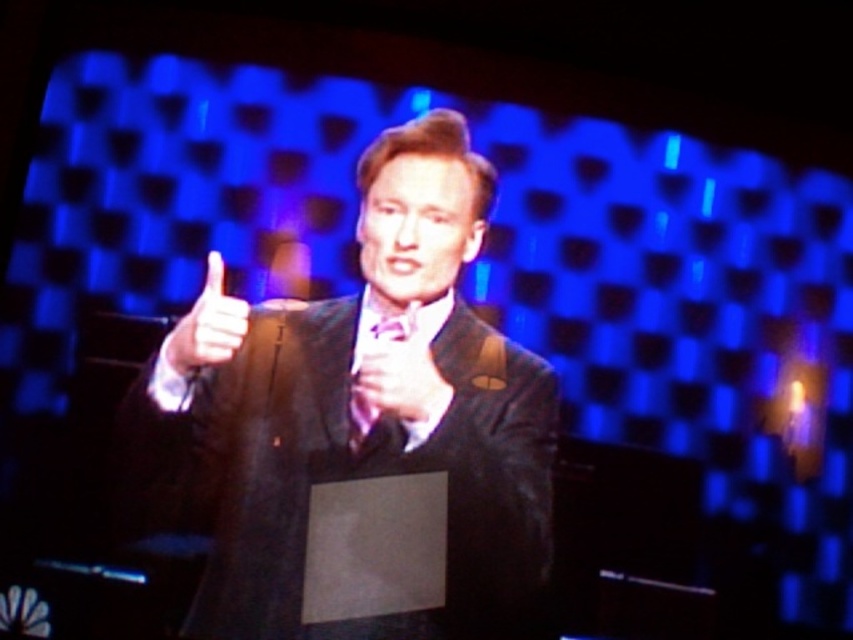
Can you confirm if shiny black suit at center is thinner than matte black thumb at left?

Incorrect, shiny black suit at center's width is not less than matte black thumb at left's.

Between shiny black suit at center and matte black thumb at left, which one is positioned lower?

shiny black suit at center is below.

This screenshot has height=640, width=853. What are the coordinates of `shiny black suit at center` in the screenshot? It's located at (374, 426).

Looking at this image, which is more to the left, shiny black suit at center or matte black hand at center?

shiny black suit at center is more to the left.

Who is positioned more to the right, shiny black suit at center or matte black hand at center?

matte black hand at center is more to the right.

Is point (373, 454) positioned in front of point (433, 378)?

That is True.

I want to click on shiny black suit at center, so click(x=374, y=426).

Consider the image. Which is below, matte black hand at center or matte black thumb at left?

matte black hand at center is below.

Between point (376, 349) and point (234, 330), which one is positioned in front?

Point (234, 330) is in front.

The width and height of the screenshot is (853, 640). Identify the location of matte black hand at center. (401, 380).